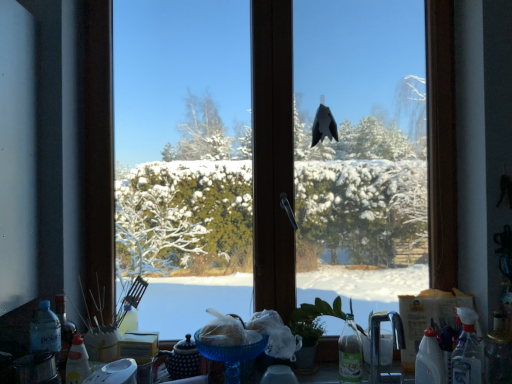
Question: Does transparent plastic spray bottle at lower right, the second bottle positioned from the right, have a greater width compared to translucent plastic bottle at lower left, which is counted as the second bottle, starting from the left?

Choices:
 (A) no
 (B) yes

Answer: (B)

Question: Is transparent plastic spray bottle at lower right, the second bottle positioned from the right, taller than translucent plastic bottle at lower left, placed as the fourth bottle when sorted from right to left?

Choices:
 (A) no
 (B) yes

Answer: (B)

Question: From the image's perspective, is transparent plastic spray bottle at lower right, the second bottle positioned from the right, beneath translucent plastic bottle at lower left, which is counted as the second bottle, starting from the left?

Choices:
 (A) no
 (B) yes

Answer: (A)

Question: From a real-world perspective, does transparent plastic spray bottle at lower right, the second bottle positioned from the right, stand above translucent plastic bottle at lower left, placed as the fourth bottle when sorted from right to left?

Choices:
 (A) no
 (B) yes

Answer: (B)

Question: Does transparent plastic spray bottle at lower right, the second bottle positioned from the right, lie in front of translucent plastic bottle at lower left, which is counted as the second bottle, starting from the left?

Choices:
 (A) no
 (B) yes

Answer: (A)

Question: Considering the positions of satin nickel faucet at lower right and clear plastic bottle at lower right, the third bottle in the right-to-left sequence, in the image, is satin nickel faucet at lower right wider or thinner than clear plastic bottle at lower right, the third bottle in the right-to-left sequence,?

Choices:
 (A) wide
 (B) thin

Answer: (A)

Question: Considering the positions of satin nickel faucet at lower right and clear plastic bottle at lower right, arranged as the third bottle when viewed from the left, in the image, is satin nickel faucet at lower right bigger or smaller than clear plastic bottle at lower right, arranged as the third bottle when viewed from the left,?

Choices:
 (A) big
 (B) small

Answer: (A)

Question: From a real-world perspective, is satin nickel faucet at lower right above or below clear plastic bottle at lower right, the third bottle in the right-to-left sequence?

Choices:
 (A) below
 (B) above

Answer: (B)

Question: Is satin nickel faucet at lower right in front of or behind clear plastic bottle at lower right, arranged as the third bottle when viewed from the left, in the image?

Choices:
 (A) behind
 (B) front

Answer: (B)

Question: Considering the relative positions of clear plastic bottle at lower right, arranged as the third bottle when viewed from the left, and translucent plastic bottle at lower left, which is the first bottle in left-to-right order, in the image provided, is clear plastic bottle at lower right, arranged as the third bottle when viewed from the left, to the left or to the right of translucent plastic bottle at lower left, which is the first bottle in left-to-right order,?

Choices:
 (A) left
 (B) right

Answer: (B)

Question: Relative to translucent plastic bottle at lower left, the fifth bottle positioned from the right, is clear plastic bottle at lower right, arranged as the third bottle when viewed from the left, in front or behind?

Choices:
 (A) front
 (B) behind

Answer: (A)

Question: Considering the positions of point (440, 379) and point (49, 322), is point (440, 379) closer or farther from the camera than point (49, 322)?

Choices:
 (A) closer
 (B) farther

Answer: (A)

Question: Based on their sizes in the image, would you say clear plastic bottle at lower right, the third bottle in the right-to-left sequence, is bigger or smaller than translucent plastic bottle at lower left, the fifth bottle positioned from the right?

Choices:
 (A) small
 (B) big

Answer: (A)

Question: Is translucent plastic bottle at lower left, which is the first bottle in left-to-right order, inside or outside of transparent glass window at center?

Choices:
 (A) outside
 (B) inside

Answer: (A)

Question: Looking at their shapes, would you say translucent plastic bottle at lower left, which is the first bottle in left-to-right order, is wider or thinner than transparent glass window at center?

Choices:
 (A) thin
 (B) wide

Answer: (A)